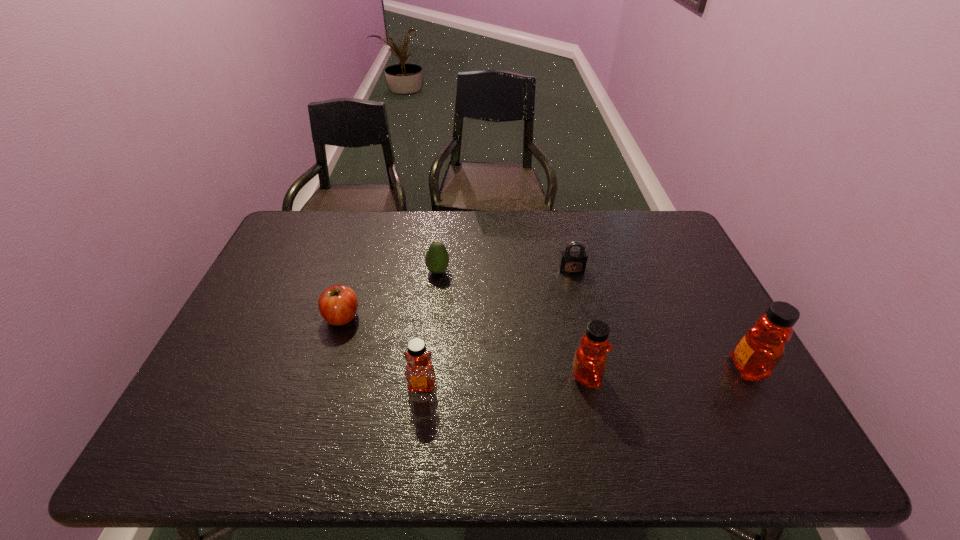
The image size is (960, 540). Find the location of `the shortest honey`. the shortest honey is located at coordinates (419, 372).

Find the location of a particular element. The image size is (960, 540). the fourth shortest object is located at coordinates (419, 372).

Find the location of a particular element. The image size is (960, 540). the second shortest honey is located at coordinates (x=588, y=367).

The height and width of the screenshot is (540, 960). What are the coordinates of `the second honey from right to left` in the screenshot? It's located at click(588, 367).

Identify the location of the rightmost honey. This screenshot has width=960, height=540. (758, 352).

Where is `the third farthest object`? This screenshot has width=960, height=540. the third farthest object is located at coordinates (338, 304).

The width and height of the screenshot is (960, 540). Find the location of `the leftmost object`. the leftmost object is located at coordinates (338, 304).

Where is `avocado`? Image resolution: width=960 pixels, height=540 pixels. avocado is located at coordinates (437, 258).

At what (x,y) coordinates should I click in order to perform the action: click on padlock. Please return your answer as a coordinate pair (x, y). This screenshot has height=540, width=960. Looking at the image, I should click on (571, 262).

At what (x,y) coordinates should I click in order to perform the action: click on free space located 0.310m on the front label of the second honey from right to left. Please return your answer as a coordinate pair (x, y). The height and width of the screenshot is (540, 960). Looking at the image, I should click on (729, 376).